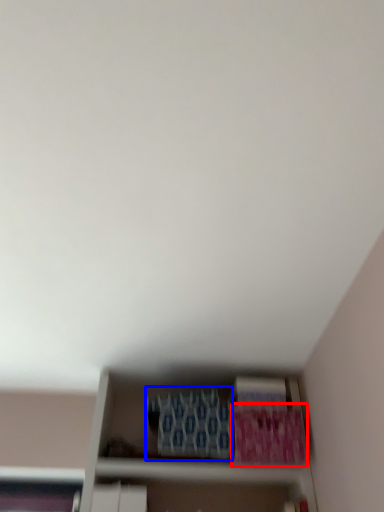
Question: Among these objects, which one is farthest to the camera, paperback book (highlighted by a red box) or paperback book (highlighted by a blue box)?

Choices:
 (A) paperback book
 (B) paperback book

Answer: (A)